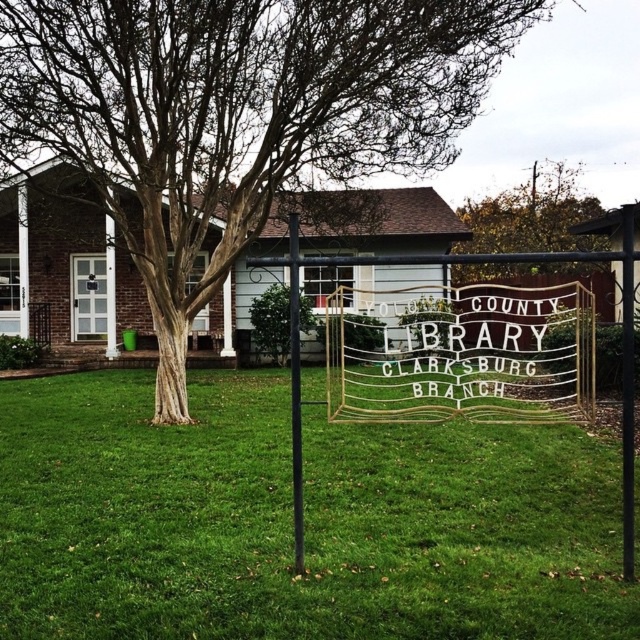
Describe the element at coordinates (236, 115) in the screenshot. This screenshot has height=640, width=640. I see `brown bark tree at center` at that location.

Between brown bark tree at center and metallic pole at center, which one has more height?

With more height is metallic pole at center.

Which is behind, point (324, 81) or point (298, 426)?

Positioned behind is point (324, 81).

At what (x,y) coordinates should I click in order to perform the action: click on brown bark tree at center. Please return your answer as a coordinate pair (x, y). The width and height of the screenshot is (640, 640). Looking at the image, I should click on (236, 115).

Who is shorter, green grass at center or brown bark tree at center?

With less height is brown bark tree at center.

Does point (326, 483) come behind point (234, 228)?

No.

Find the location of a particular element. This screenshot has height=640, width=640. green grass at center is located at coordinates (291, 520).

Image resolution: width=640 pixels, height=640 pixels. What do you see at coordinates (291, 520) in the screenshot?
I see `green grass at center` at bounding box center [291, 520].

Which is in front, point (266, 524) or point (275, 307)?

Positioned in front is point (266, 524).

The width and height of the screenshot is (640, 640). What do you see at coordinates (291, 520) in the screenshot?
I see `green grass at center` at bounding box center [291, 520].

Identify the location of green grass at center. (291, 520).